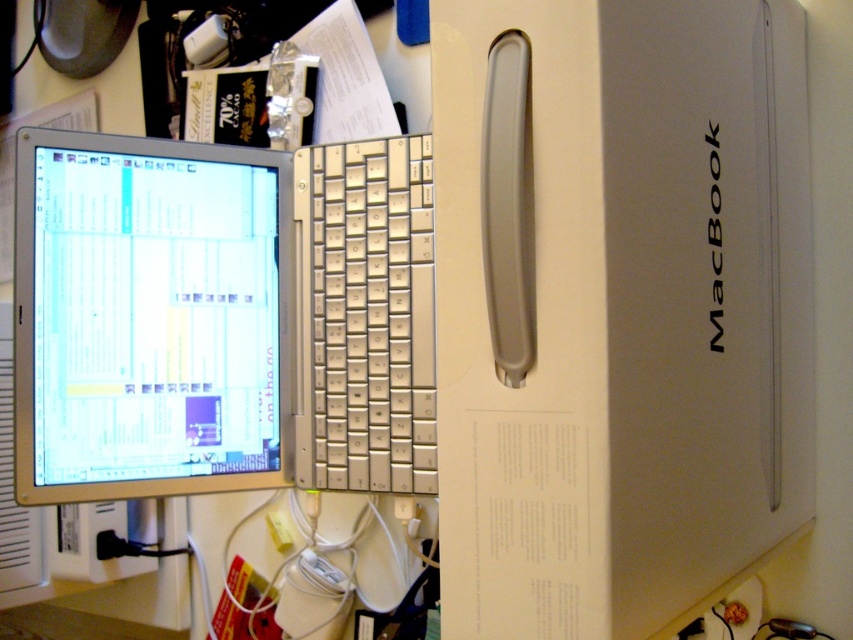
Question: Does silver metallic macbook at center have a lesser width compared to silver metallic computer monitor at center?

Choices:
 (A) no
 (B) yes

Answer: (A)

Question: Among these objects, which one is nearest to the camera?

Choices:
 (A) silver metallic computer monitor at center
 (B) silver metallic keyboard at center
 (C) silver metallic macbook at center

Answer: (C)

Question: Which of the following is the closest to the observer?

Choices:
 (A) silver metallic macbook at center
 (B) silver metallic computer monitor at center

Answer: (A)

Question: Does silver metallic macbook at center appear on the right side of silver metallic keyboard at center?

Choices:
 (A) no
 (B) yes

Answer: (B)

Question: Estimate the real-world distances between objects in this image. Which object is closer to the silver metallic macbook at center?

Choices:
 (A) silver metallic keyboard at center
 (B) silver metallic computer monitor at center

Answer: (A)

Question: Can you confirm if silver metallic computer monitor at center is thinner than silver metallic keyboard at center?

Choices:
 (A) no
 (B) yes

Answer: (A)